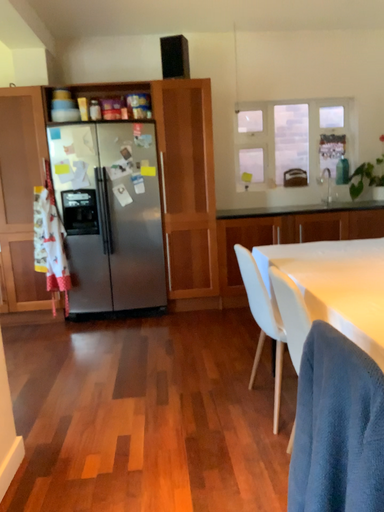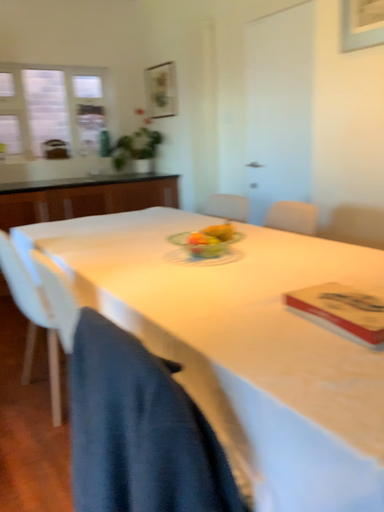
Question: Which way did the camera rotate in the video?

Choices:
 (A) rotated right
 (B) rotated left

Answer: (A)